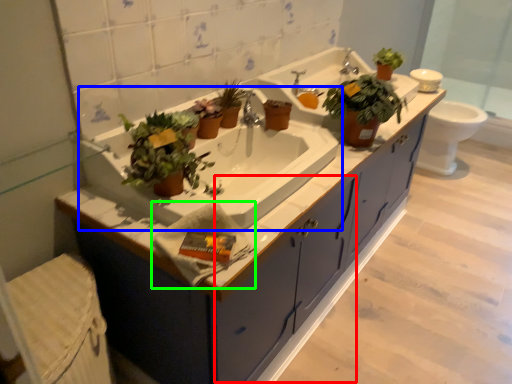
Question: Which object is positioned closest to drawer (highlighted by a red box)? Select from sink (highlighted by a blue box) and hand towel (highlighted by a green box).

Choices:
 (A) sink
 (B) hand towel

Answer: (A)